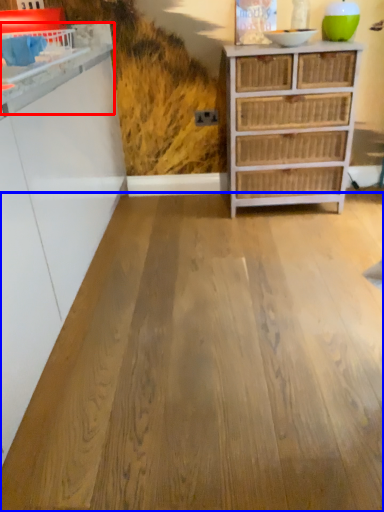
Question: Among these objects, which one is farthest to the camera, counter (highlighted by a red box) or plywood (highlighted by a blue box)?

Choices:
 (A) counter
 (B) plywood

Answer: (A)